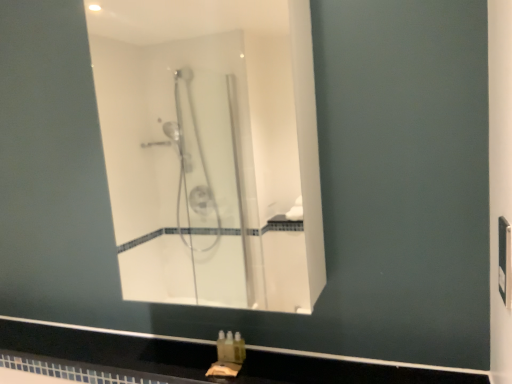
Question: Does translucent plastic soap at lower center have a lesser height compared to black glossy counter top at lower center?

Choices:
 (A) no
 (B) yes

Answer: (A)

Question: From a real-world perspective, is translucent plastic soap at lower center over black glossy counter top at lower center?

Choices:
 (A) no
 (B) yes

Answer: (B)

Question: Is translucent plastic soap at lower center smaller than black glossy counter top at lower center?

Choices:
 (A) yes
 (B) no

Answer: (A)

Question: From a real-world perspective, is translucent plastic soap at lower center beneath black glossy counter top at lower center?

Choices:
 (A) no
 (B) yes

Answer: (A)

Question: Considering the relative sizes of translucent plastic soap at lower center and black glossy counter top at lower center in the image provided, is translucent plastic soap at lower center bigger than black glossy counter top at lower center?

Choices:
 (A) yes
 (B) no

Answer: (B)

Question: Is point (238, 344) positioned closer to the camera than point (334, 372)?

Choices:
 (A) farther
 (B) closer

Answer: (A)

Question: In the image, is translucent plastic soap at lower center positioned in front of or behind black glossy counter top at lower center?

Choices:
 (A) front
 (B) behind

Answer: (B)

Question: In terms of width, does translucent plastic soap at lower center look wider or thinner when compared to black glossy counter top at lower center?

Choices:
 (A) wide
 (B) thin

Answer: (B)

Question: From the image's perspective, is translucent plastic soap at lower center positioned above or below black glossy counter top at lower center?

Choices:
 (A) below
 (B) above

Answer: (B)

Question: Is clear glass shower at center situated inside translucent plastic soap at lower center or outside?

Choices:
 (A) inside
 (B) outside

Answer: (B)

Question: From the image's perspective, is clear glass shower at center above or below translucent plastic soap at lower center?

Choices:
 (A) below
 (B) above

Answer: (B)

Question: Is clear glass shower at center to the left or to the right of translucent plastic soap at lower center in the image?

Choices:
 (A) left
 (B) right

Answer: (A)

Question: Looking at the image, does clear glass shower at center seem bigger or smaller compared to translucent plastic soap at lower center?

Choices:
 (A) big
 (B) small

Answer: (A)

Question: Does point (117, 382) appear closer or farther from the camera than point (117, 236)?

Choices:
 (A) farther
 (B) closer

Answer: (B)

Question: From a real-world perspective, relative to clear glass shower at center, is black glossy counter top at lower center vertically above or below?

Choices:
 (A) above
 (B) below

Answer: (B)